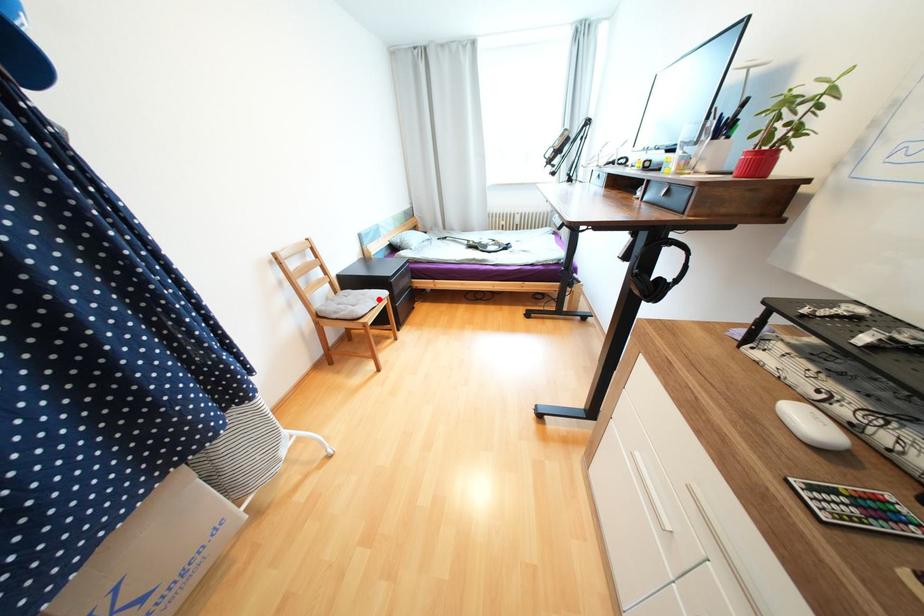
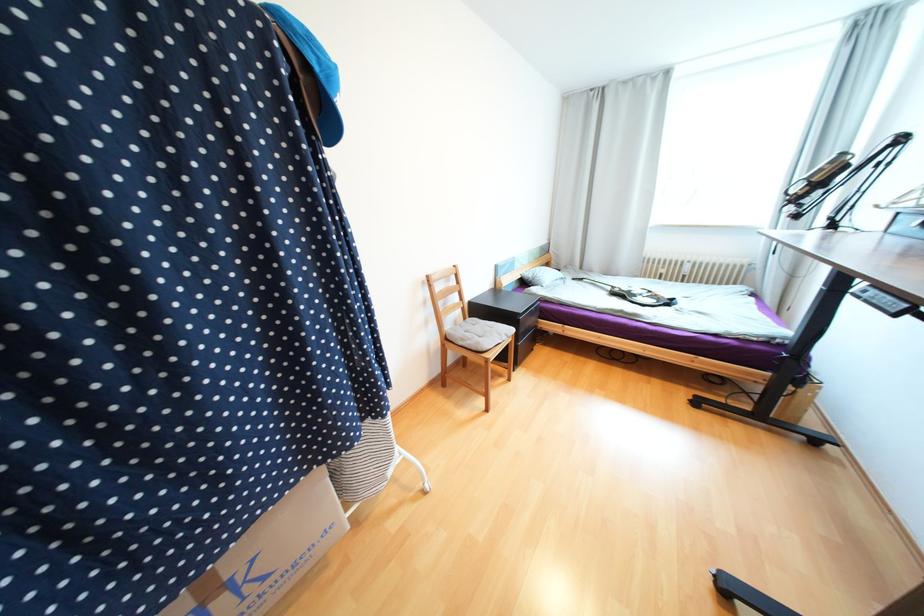
Question: I am providing you with two images of the same scene from different viewpoints. Given a red point in image1, look at the same physical point in image2. Is it:

Choices:
 (A) Closer to the viewpoint
 (B) Farther from the viewpoint

Answer: (B)